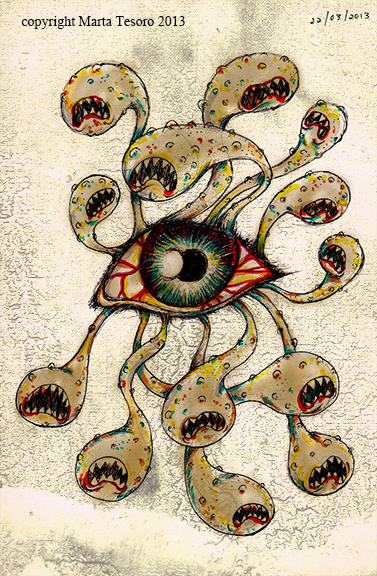
Locate an element on the screen. The width and height of the screenshot is (377, 576). art work is located at coordinates (193, 261).